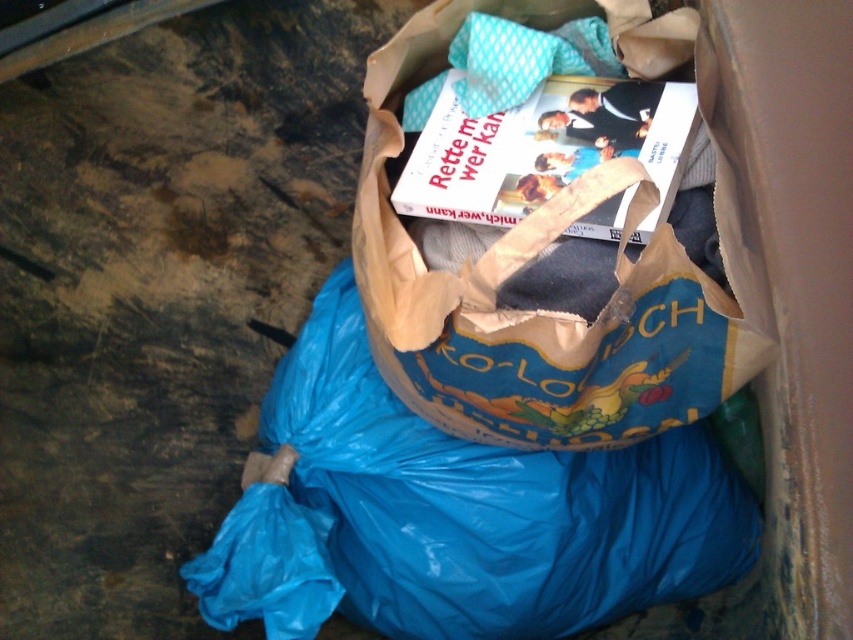
Does blue paper bag at center appear on the right side of white paper book at center?

No, blue paper bag at center is not to the right of white paper book at center.

Between blue paper bag at center and white paper book at center, which one is positioned higher?

white paper book at center is higher up.

Does point (686, 276) come in front of point (665, 195)?

Yes, point (686, 276) is closer to viewer.

Where is `blue paper bag at center`? The width and height of the screenshot is (853, 640). blue paper bag at center is located at coordinates (532, 310).